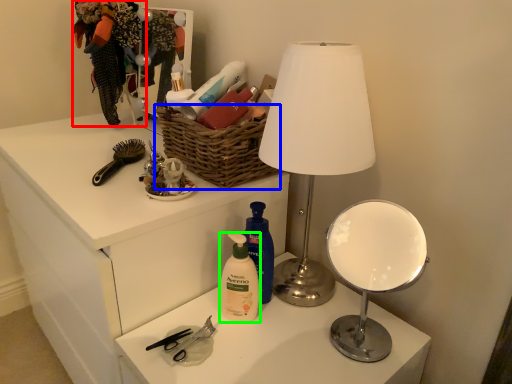
Question: Considering the real-world distances, which object is farthest from clothing (highlighted by a red box)? basket (highlighted by a blue box) or cleaning product (highlighted by a green box)?

Choices:
 (A) basket
 (B) cleaning product

Answer: (B)